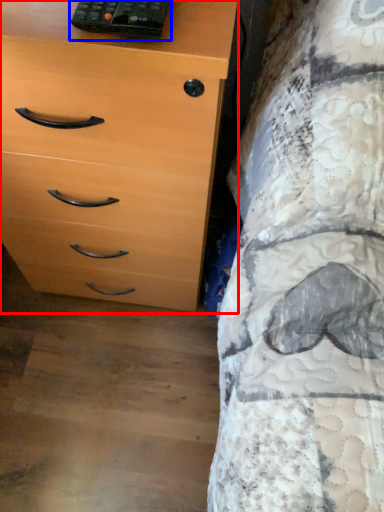
Question: Which point is closer to the camera, chest of drawers (highlighted by a red box) or control (highlighted by a blue box)?

Choices:
 (A) chest of drawers
 (B) control

Answer: (A)